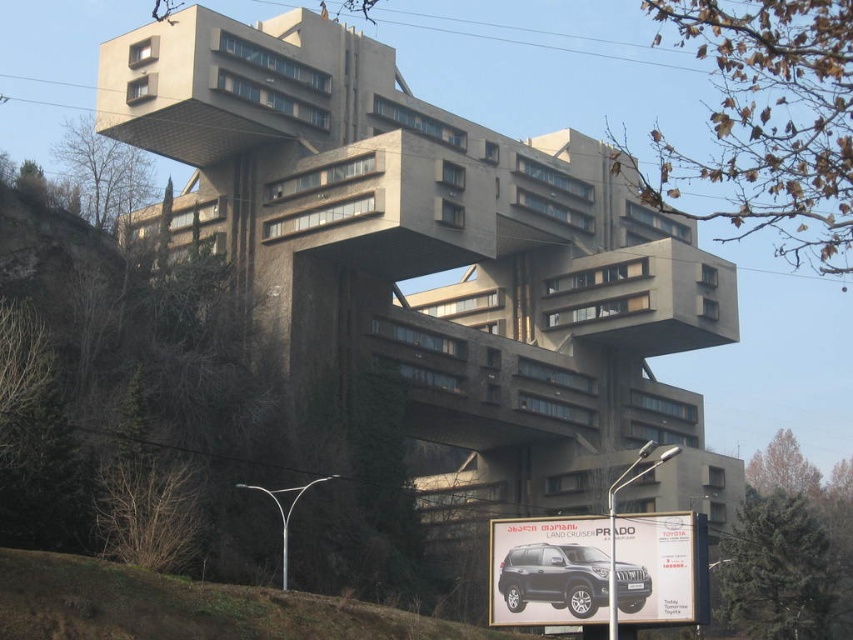
You are standing 50 meters away from the building. You want to walk towards the brown grass at lower left. Is the distance sufficient to reach it?

The brown grass at lower left is 52.91 meters away from the viewer. Since you are only 50 meters away from the building, you are not close enough to reach the brown grass at lower left.

You are standing at the base of the building and looking towards the cantilevered section. You notice two points marked on the facade at coordinates point [604,372] and point [604,577]. From your vantage point, which point is closer to you?

Point [604,577] is closer to you because it is in front of point [604,372] according to their spatial arrangement.